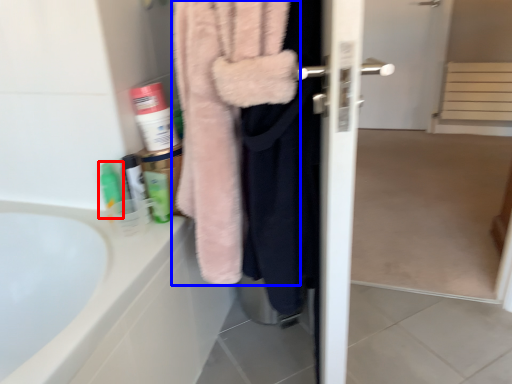
Question: Which of the following is the closest to the observer, toiletry (highlighted by a red box) or towel (highlighted by a blue box)?

Choices:
 (A) toiletry
 (B) towel

Answer: (B)